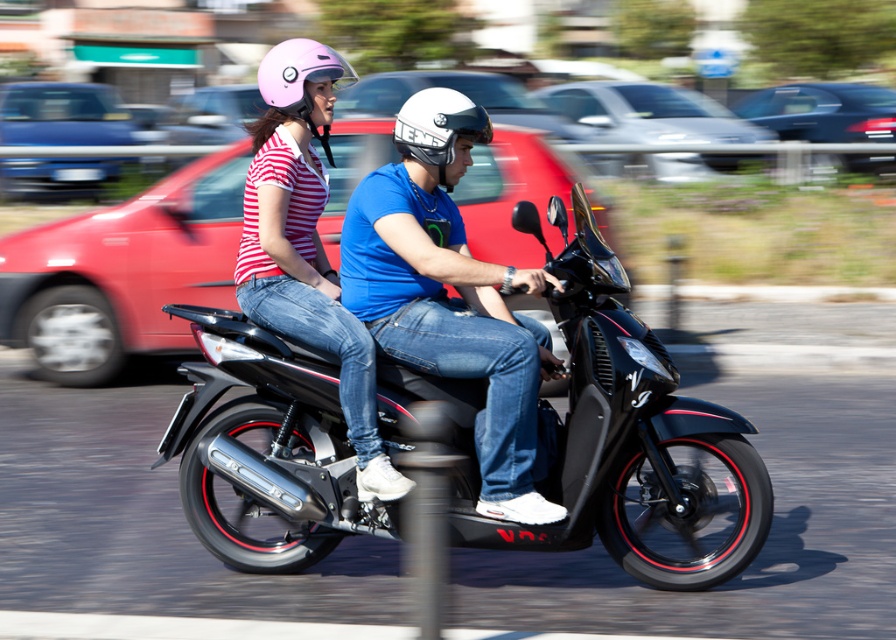
Question: Which point is farther to the camera?

Choices:
 (A) black matte scooter at center
 (B) white matte helmet at center

Answer: (B)

Question: Which is nearer to the pink matte helmet at upper center?

Choices:
 (A) black matte scooter at center
 (B) shiny black scooter at center

Answer: (B)

Question: Is black matte scooter at center smaller than white matte helmet at center?

Choices:
 (A) no
 (B) yes

Answer: (A)

Question: Can you confirm if pink matte helmet at upper center is positioned to the left of white matte helmet at center?

Choices:
 (A) no
 (B) yes

Answer: (B)

Question: Does black matte scooter at center appear over white matte helmet at center?

Choices:
 (A) no
 (B) yes

Answer: (A)

Question: Which object is the farthest from the white matte helmet at center?

Choices:
 (A) pink matte helmet at upper center
 (B) shiny black scooter at center
 (C) black matte scooter at center

Answer: (C)